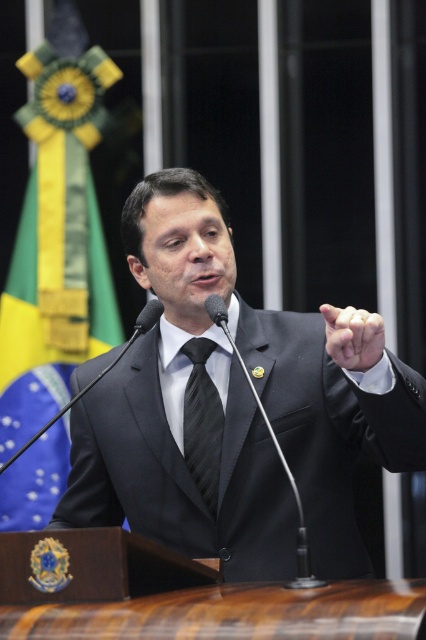
Between point (293, 586) and point (218, 320), which one is positioned behind?

Point (218, 320)

This screenshot has height=640, width=426. I want to click on black metallic microphone at center, so click(290, 486).

Image resolution: width=426 pixels, height=640 pixels. I want to click on black metallic microphone at center, so click(x=290, y=486).

I want to click on black metallic microphone at center, so click(x=290, y=486).

Who is positioned more to the right, black metallic microphone at center or black matte microphone at center?

Positioned to the right is black metallic microphone at center.

Which of these two, black metallic microphone at center or black matte microphone at center, stands shorter?

black matte microphone at center is shorter.

Find the location of a particular element. black metallic microphone at center is located at coordinates (290, 486).

In order to click on black metallic microphone at center in this screenshot , I will do `click(290, 486)`.

Is black striped tie at center shorter than black plastic microphone at center?

No, black striped tie at center is not shorter than black plastic microphone at center.

In the scene shown: Does black striped tie at center appear under black plastic microphone at center?

Correct, black striped tie at center is located below black plastic microphone at center.

Is point (189, 419) less distant than point (224, 321)?

No.

The height and width of the screenshot is (640, 426). Identify the location of black striped tie at center. (203, 422).